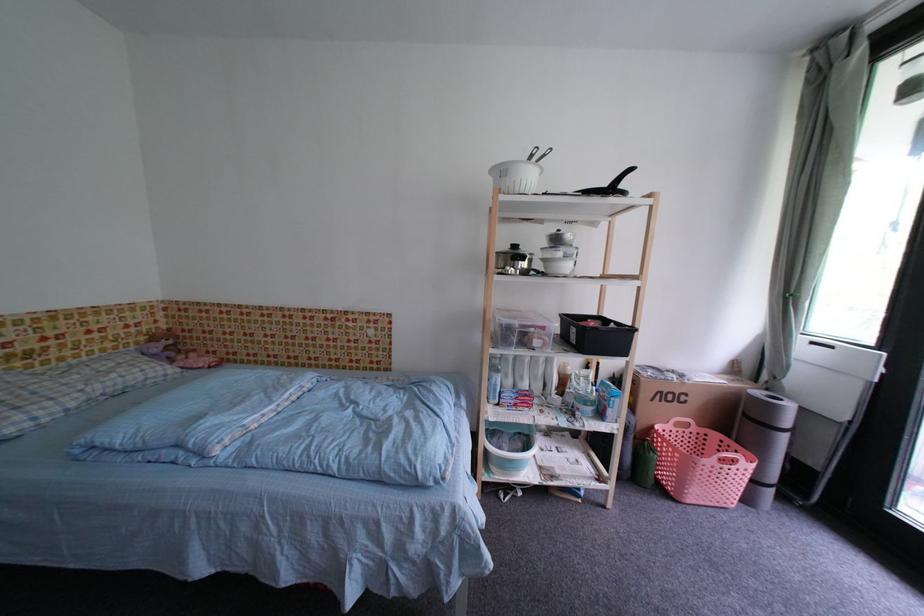
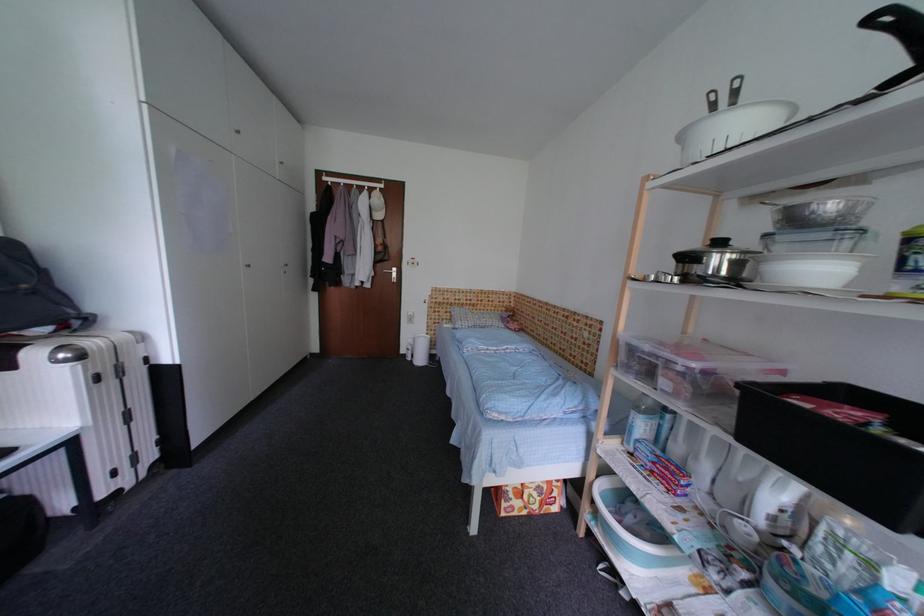
Question: The images are taken continuously from a first-person perspective. In which direction is your viewpoint rotating?

Choices:
 (A) Left
 (B) Right
 (C) Up
 (D) Down

Answer: (A)